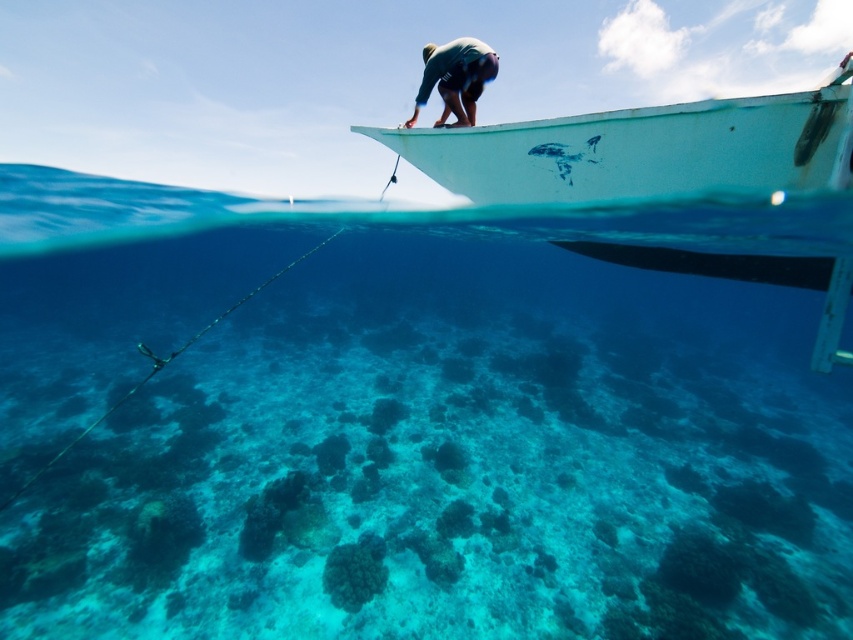
You are on a boat and want to place two buoys at the coordinates point (257, 492) and point (450, 92). Which buoy will be closer to the boat?

Point (450, 92) is closer to the boat because point (257, 492) is behind it.

You are a marine biologist observing the underwater scene from the boat. You notice the clear blue water at center and the white matte boat at upper right. Which object occupies a wider area in the image?

The clear blue water at center occupies a wider area in the image because its width is larger than that of the white matte boat at upper right.

You are a snorkeler preparing to jump into the water. You see the clear blue water at center and the dark green wetsuit at upper center. Which object is closer to you as you stand on the boat?

The clear blue water at center is closer to the viewer than the dark green wetsuit at upper center.